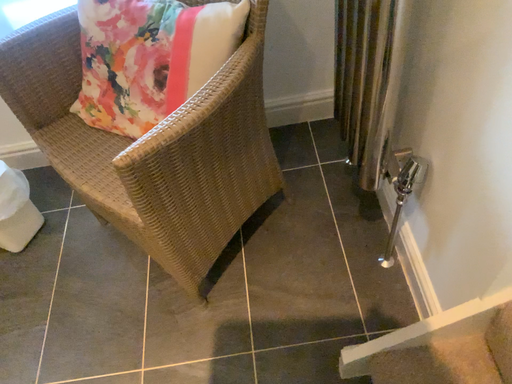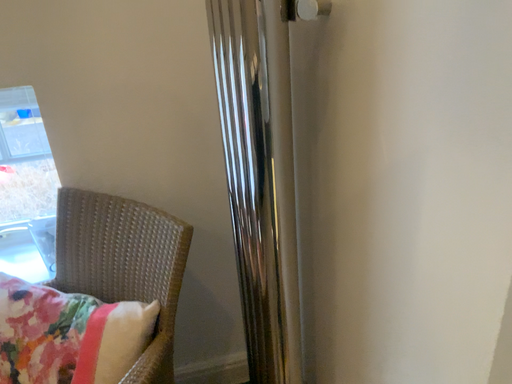
Question: How did the camera likely rotate when shooting the video?

Choices:
 (A) rotated upward
 (B) rotated downward

Answer: (A)